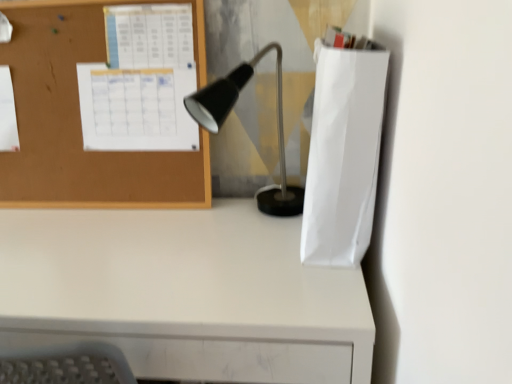
Question: Is white matte paper bag at right oriented towards white matte desk at lower left?

Choices:
 (A) no
 (B) yes

Answer: (A)

Question: Does white matte paper bag at right have a lesser width compared to white matte desk at lower left?

Choices:
 (A) yes
 (B) no

Answer: (A)

Question: Does white matte paper bag at right have a lesser height compared to white matte desk at lower left?

Choices:
 (A) yes
 (B) no

Answer: (A)

Question: Are white matte paper bag at right and white matte desk at lower left making contact?

Choices:
 (A) no
 (B) yes

Answer: (A)

Question: From the image's perspective, is white matte paper bag at right located beneath white matte desk at lower left?

Choices:
 (A) no
 (B) yes

Answer: (A)

Question: From a real-world perspective, is white matte paper bag at right located beneath white matte desk at lower left?

Choices:
 (A) no
 (B) yes

Answer: (A)

Question: Can we say corkboard at upper left lies outside matte black lamp at center?

Choices:
 (A) yes
 (B) no

Answer: (A)

Question: From a real-world perspective, is corkboard at upper left positioned under matte black lamp at center based on gravity?

Choices:
 (A) yes
 (B) no

Answer: (B)

Question: Is corkboard at upper left oriented away from matte black lamp at center?

Choices:
 (A) yes
 (B) no

Answer: (B)

Question: From a real-world perspective, is corkboard at upper left physically above matte black lamp at center?

Choices:
 (A) yes
 (B) no

Answer: (A)

Question: Does corkboard at upper left lie in front of matte black lamp at center?

Choices:
 (A) yes
 (B) no

Answer: (B)

Question: Is the surface of corkboard at upper left in direct contact with matte black lamp at center?

Choices:
 (A) yes
 (B) no

Answer: (B)

Question: Is matte black lamp at center located outside white matte paper bag at right?

Choices:
 (A) yes
 (B) no

Answer: (A)